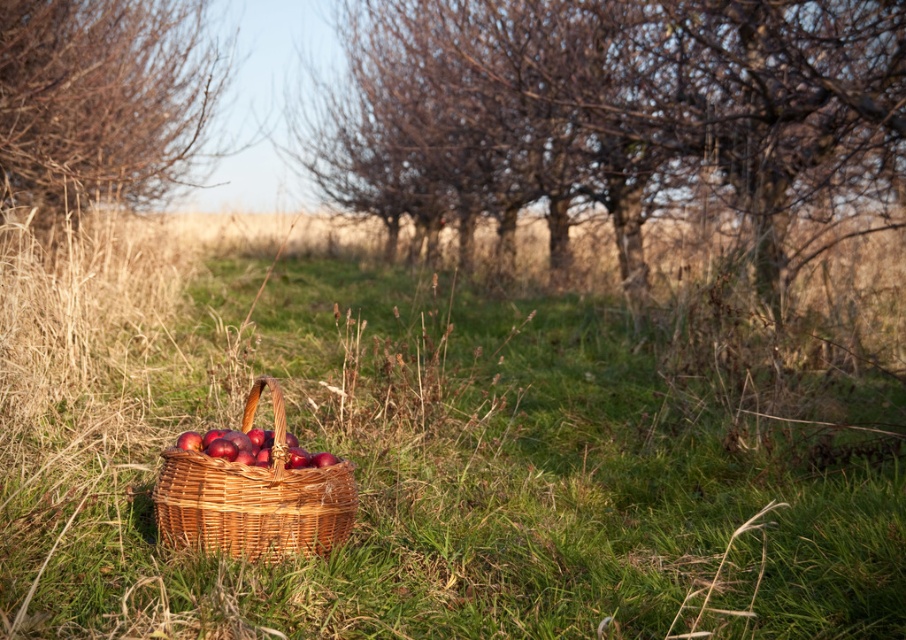
Is brown bark tree at center behind shiny red apples at center?

Yes, brown bark tree at center is further from the viewer.

Does brown bark tree at center have a smaller size compared to shiny red apples at center?

Incorrect, brown bark tree at center is not smaller in size than shiny red apples at center.

Between point (565, 179) and point (296, 448), which one is positioned behind?

The point (565, 179) is behind.

I want to click on brown bark tree at center, so click(x=615, y=116).

From the picture: Is woven brown basket at center bigger than shiny red apples at center?

Yes, woven brown basket at center is bigger than shiny red apples at center.

Which is in front, point (270, 536) or point (198, 442)?

Positioned in front is point (270, 536).

Locate an element on the screen. woven brown basket at center is located at coordinates (253, 497).

Can you confirm if brown textured bush at left is taller than woven brown basket at center?

Yes, brown textured bush at left is taller than woven brown basket at center.

Which is behind, point (71, 28) or point (199, 461)?

The point (71, 28) is more distant.

Identify the location of brown textured bush at left. (102, 99).